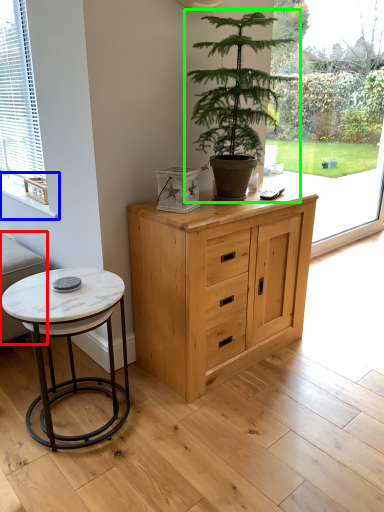
Question: Which is farther away from couch (highlighted by a red box)? window sill (highlighted by a blue box) or houseplant (highlighted by a green box)?

Choices:
 (A) window sill
 (B) houseplant

Answer: (B)